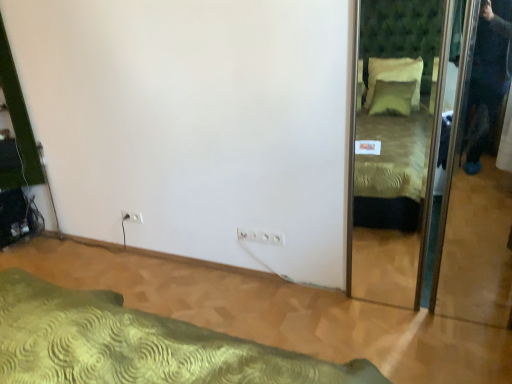
Locate an element on the screen. This screenshot has width=512, height=384. free space in front of green textured mirror at right is located at coordinates (450, 346).